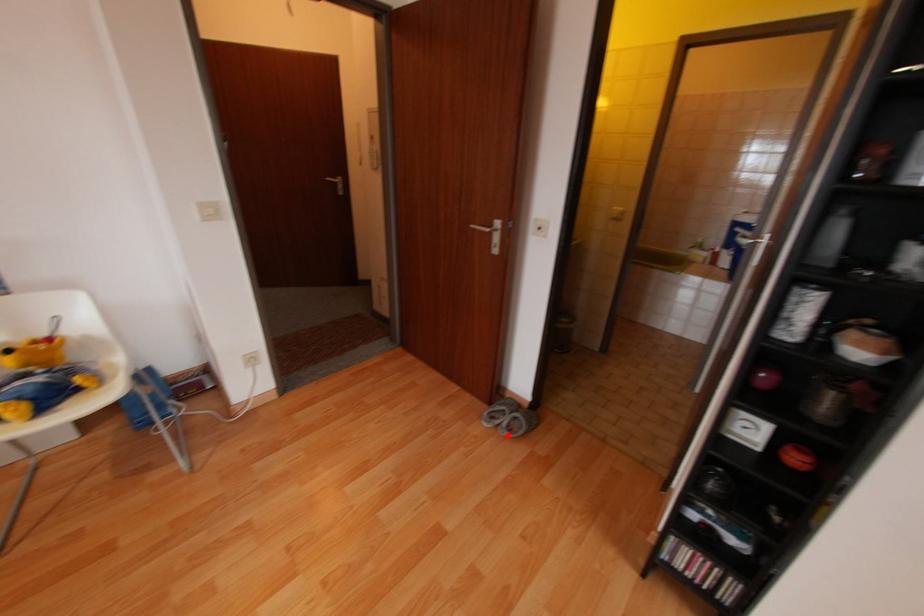
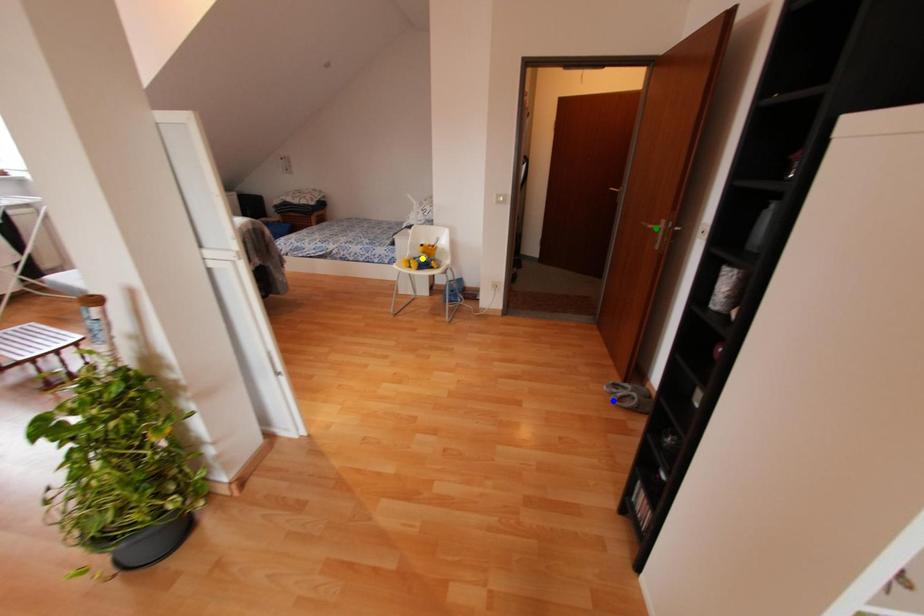
Question: I am providing you with two images of the same scene from different viewpoints. A red point is marked on the first image. You are given multiple points on the second image. Which spot in image 2 lines up with the point in image 1?

Choices:
 (A) yellow point
 (B) blue point
 (C) green point

Answer: (B)